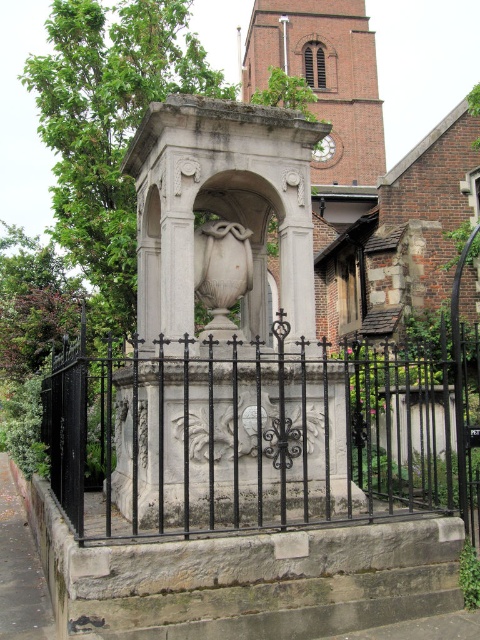
Between black wrought iron fence at center and white marble vase at center, which one has more height?

black wrought iron fence at center

Does point (445, 356) come farther from viewer compared to point (203, 300)?

No, it is not.

This screenshot has height=640, width=480. I want to click on black wrought iron fence at center, so click(264, 433).

Does point (231, 493) lie in front of point (190, 244)?

Yes, point (231, 493) is closer to viewer.

Is point (226, 376) positioned after point (303, 432)?

That is True.

What do you see at coordinates (264, 433) in the screenshot?
I see `black wrought iron fence at center` at bounding box center [264, 433].

Identify the location of black wrought iron fence at center. This screenshot has height=640, width=480. (264, 433).

Who is positioned more to the right, white stone urn at center or white marble vase at center?

white stone urn at center

Can you confirm if white stone urn at center is positioned to the right of white marble vase at center?

A: Indeed, white stone urn at center is positioned on the right side of white marble vase at center.

The height and width of the screenshot is (640, 480). In order to click on white stone urn at center in this screenshot , I will do `click(216, 307)`.